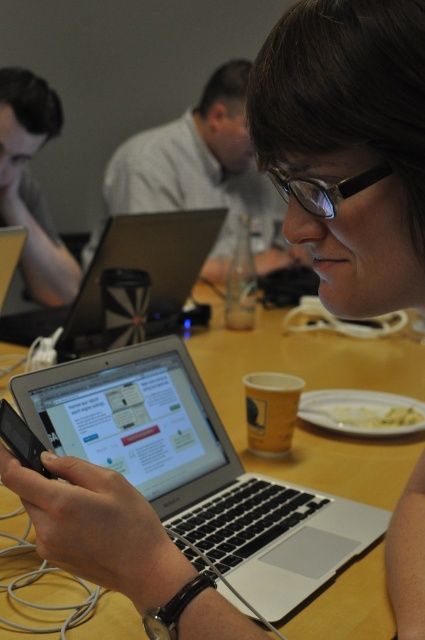
Question: Can you confirm if silver/black laptop at center is positioned above satin black laptop at center?

Choices:
 (A) yes
 (B) no

Answer: (B)

Question: Can you confirm if matte white shirt at upper center is positioned to the right of matte black laptop at left?

Choices:
 (A) yes
 (B) no

Answer: (A)

Question: Is satin black laptop at center closer to camera compared to transparent plastic glasses at center?

Choices:
 (A) yes
 (B) no

Answer: (B)

Question: Based on their relative distances, which object is farther from the matte black laptop at left?

Choices:
 (A) silver/black laptop at center
 (B) satin black laptop at center
 (C) matte white shirt at upper center

Answer: (A)

Question: Which of the following is the closest to the observer?

Choices:
 (A) 331,186
 (B) 23,273

Answer: (A)

Question: Which point appears farthest from the camera in this image?

Choices:
 (A) (150, 182)
 (B) (11, 440)
 (C) (221, 484)

Answer: (A)